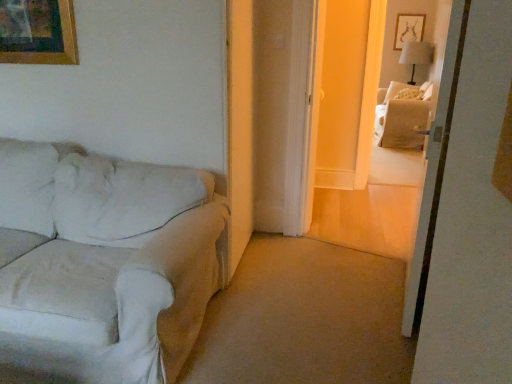
Question: In the image, is white fabric lampshade at upper right positioned in front of or behind white fabric bed at upper right?

Choices:
 (A) behind
 (B) front

Answer: (A)

Question: Does point (418, 62) appear closer or farther from the camera than point (409, 74)?

Choices:
 (A) closer
 (B) farther

Answer: (A)

Question: Considering the real-world distances, which object is farthest from the white fabric bed at upper right?

Choices:
 (A) beige fabric couch at upper right
 (B) white fabric lampshade at upper right
 (C) white fabric bed at upper right
 (D) white fabric couch at left

Answer: (D)

Question: Which object is positioned closest to the white fabric lampshade at upper right?

Choices:
 (A) white fabric couch at left
 (B) white fabric bed at upper right
 (C) beige fabric couch at upper right
 (D) white fabric bed at upper right

Answer: (B)